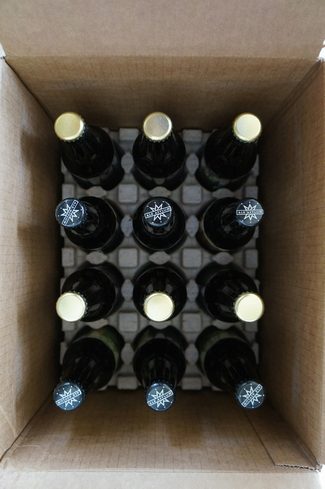
The height and width of the screenshot is (489, 325). In order to click on box sides in this screenshot , I will do `click(189, 446)`, `click(306, 381)`, `click(25, 355)`, `click(168, 82)`.